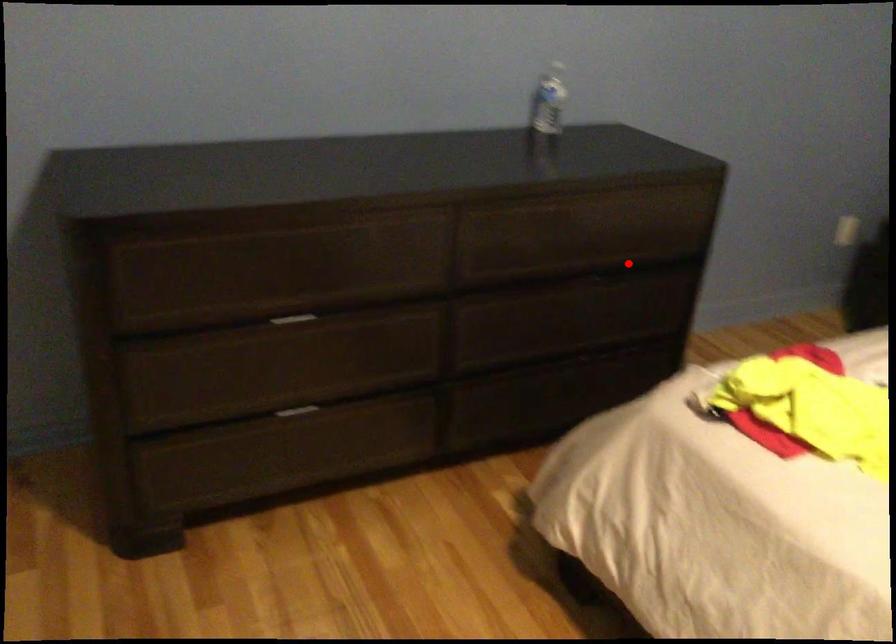
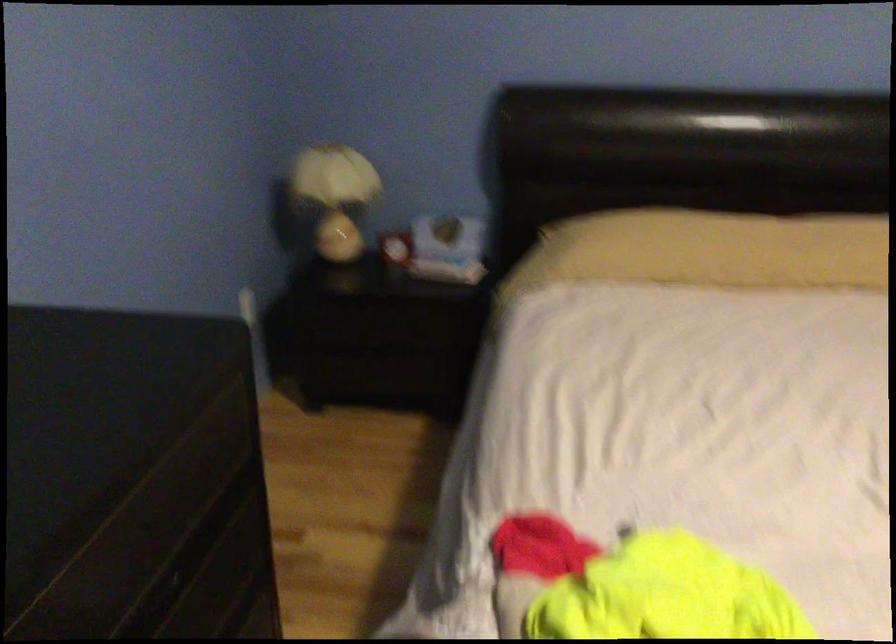
Question: I am providing you with two images of the same scene from different viewpoints. In image1, a red point is highlighted. Considering the same 3D point in image2, which of the following is correct?

Choices:
 (A) It is closer
 (B) It is farther

Answer: (A)